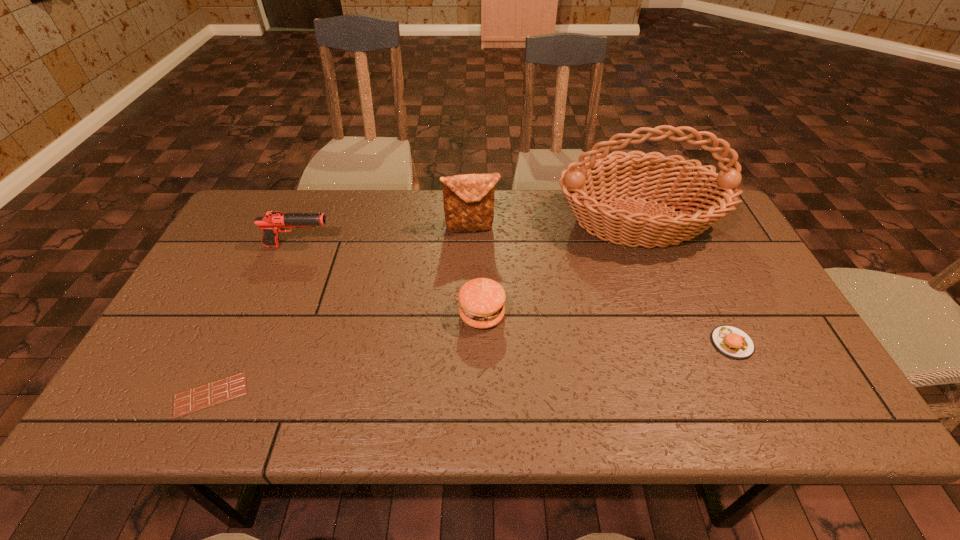
Find the location of a particular element. This screenshot has width=960, height=540. the tallest object is located at coordinates (601, 177).

This screenshot has width=960, height=540. In order to click on the second tallest object in this screenshot , I will do `click(468, 199)`.

Where is `the third tallest object`? This screenshot has height=540, width=960. the third tallest object is located at coordinates (273, 222).

The height and width of the screenshot is (540, 960). I want to click on the left patty, so click(481, 300).

Find the location of a particular element. the taller patty is located at coordinates (481, 300).

Find the location of a particular element. This screenshot has height=540, width=960. the right patty is located at coordinates (730, 341).

The width and height of the screenshot is (960, 540). What are the coordinates of `the second shortest object` in the screenshot? It's located at (730, 341).

You are a GUI agent. You are given a task and a screenshot of the screen. Output one action in this format:
    pyautogui.click(x=<x>, y=<y>)
    Task: Click on the chocolate bar
    Image resolution: width=960 pixels, height=540 pixels.
    Given the screenshot: What is the action you would take?
    pyautogui.click(x=228, y=388)

At what (x,y) coordinates should I click in order to perform the action: click on the shortest object. Please return your answer as a coordinate pair (x, y). Looking at the image, I should click on (228, 388).

Find the location of a particular element. blank area located 0.060m on the front of the basket is located at coordinates (659, 278).